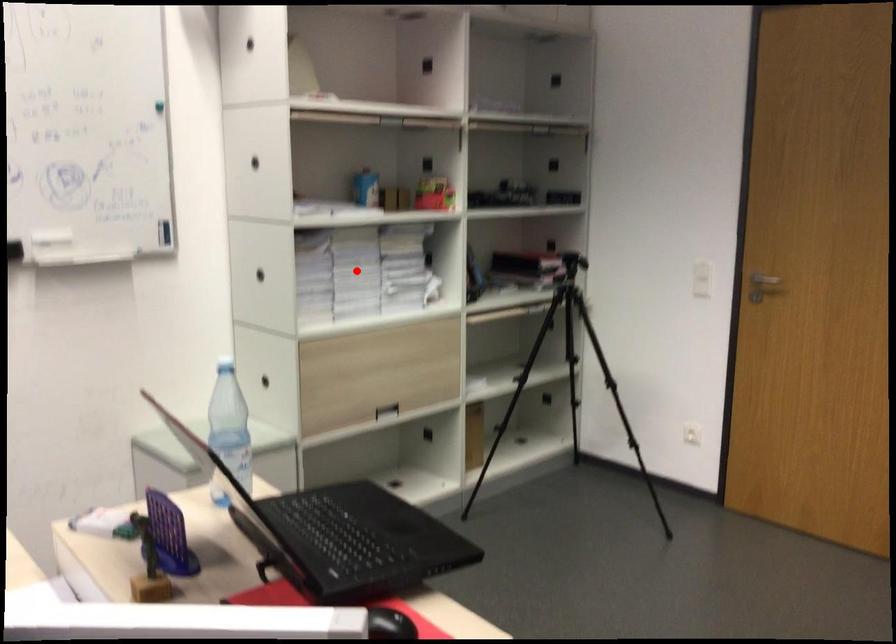
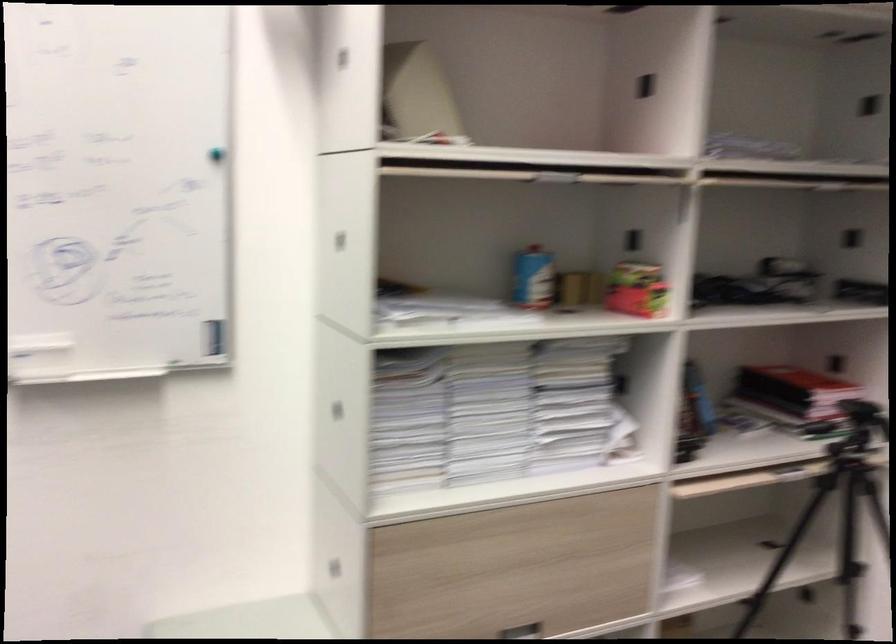
Question: I am providing you with two images of the same scene from different viewpoints. In image1, a red point is highlighted. Considering the same 3D point in image2, which of the following is correct?

Choices:
 (A) It is closer
 (B) It is farther

Answer: (A)